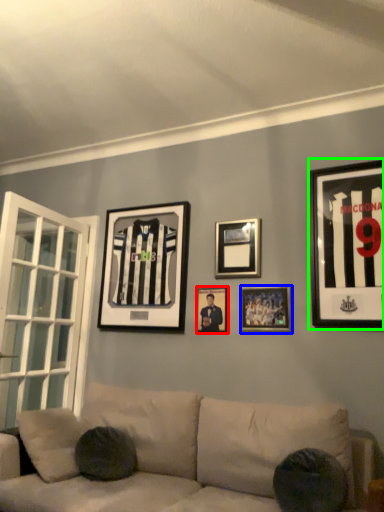
Question: Which is farther away from picture frame (highlighted by a red box)? picture frame (highlighted by a blue box) or picture frame (highlighted by a green box)?

Choices:
 (A) picture frame
 (B) picture frame

Answer: (B)